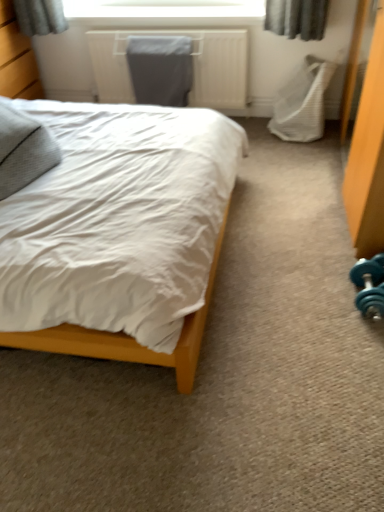
Question: From the image's perspective, is teal rubber dumbbell at lower right under gray fabric pillow at left?

Choices:
 (A) yes
 (B) no

Answer: (A)

Question: From the image's perspective, is teal rubber dumbbell at lower right on gray fabric pillow at left?

Choices:
 (A) no
 (B) yes

Answer: (A)

Question: Could you tell me if teal rubber dumbbell at lower right is facing gray fabric pillow at left?

Choices:
 (A) no
 (B) yes

Answer: (A)

Question: Is teal rubber dumbbell at lower right positioned behind gray fabric pillow at left?

Choices:
 (A) no
 (B) yes

Answer: (B)

Question: Does teal rubber dumbbell at lower right have a smaller size compared to gray fabric pillow at left?

Choices:
 (A) no
 (B) yes

Answer: (B)

Question: Is teal rubber dumbbell at lower right not near gray fabric pillow at left?

Choices:
 (A) yes
 (B) no

Answer: (A)

Question: Does gray fabric pillow at left appear on the right side of white fabric swivel chair at right?

Choices:
 (A) no
 (B) yes

Answer: (A)

Question: Is gray fabric pillow at left facing away from white fabric swivel chair at right?

Choices:
 (A) yes
 (B) no

Answer: (B)

Question: Does gray fabric pillow at left lie behind white fabric swivel chair at right?

Choices:
 (A) no
 (B) yes

Answer: (A)

Question: Does gray fabric pillow at left have a greater width compared to white fabric swivel chair at right?

Choices:
 (A) yes
 (B) no

Answer: (A)

Question: From a real-world perspective, is gray fabric pillow at left on top of white fabric swivel chair at right?

Choices:
 (A) no
 (B) yes

Answer: (B)

Question: From a real-world perspective, is gray fabric pillow at left positioned under white fabric swivel chair at right based on gravity?

Choices:
 (A) no
 (B) yes

Answer: (A)

Question: Can you confirm if white matte bed at center is thinner than wooden dresser at left?

Choices:
 (A) yes
 (B) no

Answer: (B)